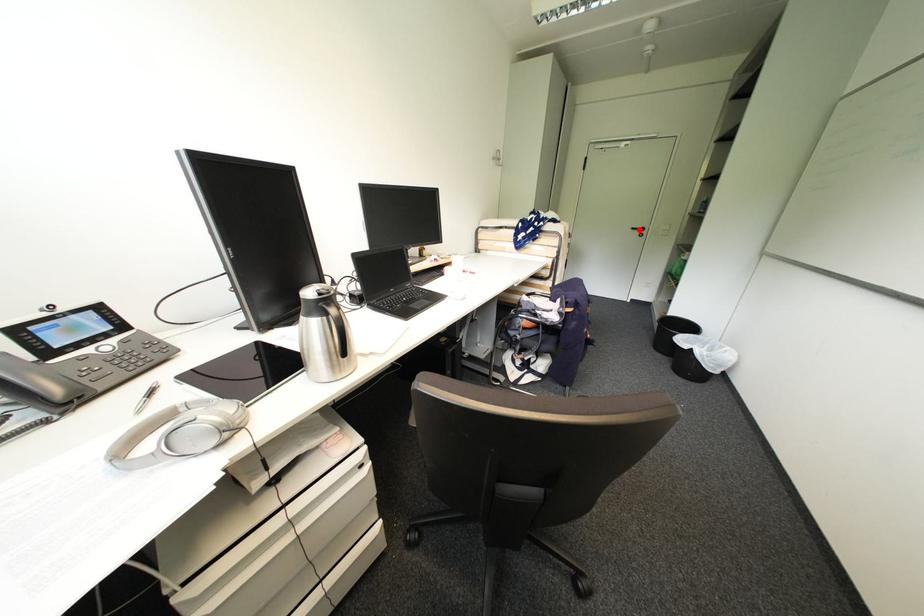
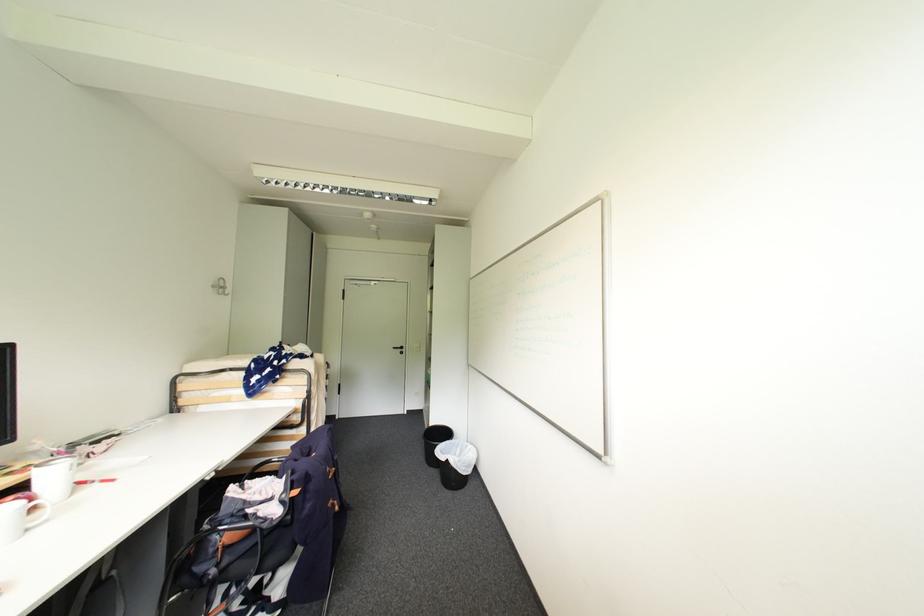
Find the pixel in the second image that matches the highlighted location in the first image.

(400, 349)